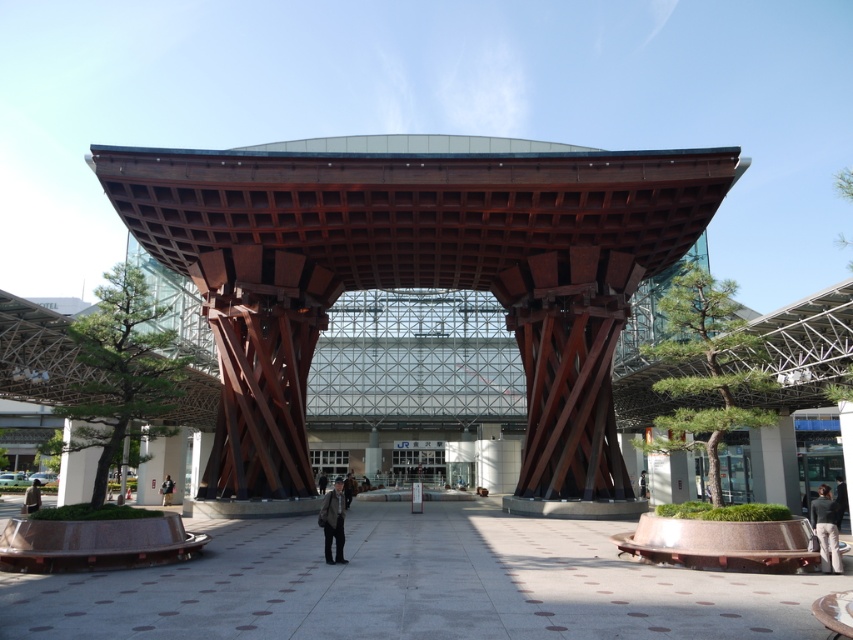
Is light beige pants at lower right positioned behind light brown leather jacket at lower left?

No, it is not.

This screenshot has width=853, height=640. Identify the location of light beige pants at lower right. (827, 529).

Is wooden structure at center wider than dark gray fabric bag at center?

Yes, wooden structure at center is wider than dark gray fabric bag at center.

Between point (643, 260) and point (167, 476), which one is positioned in front?

Point (643, 260)

The image size is (853, 640). Describe the element at coordinates (415, 273) in the screenshot. I see `wooden structure at center` at that location.

Identify the location of wooden structure at center. The height and width of the screenshot is (640, 853). (415, 273).

Can you confirm if dark brown leather jacket at center is positioned to the left of dark gray fabric bag at center?

No, dark brown leather jacket at center is not to the left of dark gray fabric bag at center.

Image resolution: width=853 pixels, height=640 pixels. In order to click on dark brown leather jacket at center in this screenshot , I will do `click(334, 522)`.

Between point (340, 513) and point (161, 483), which one is positioned behind?

The point (161, 483) is behind.

Identify the location of dark brown leather jacket at center. The width and height of the screenshot is (853, 640). (334, 522).